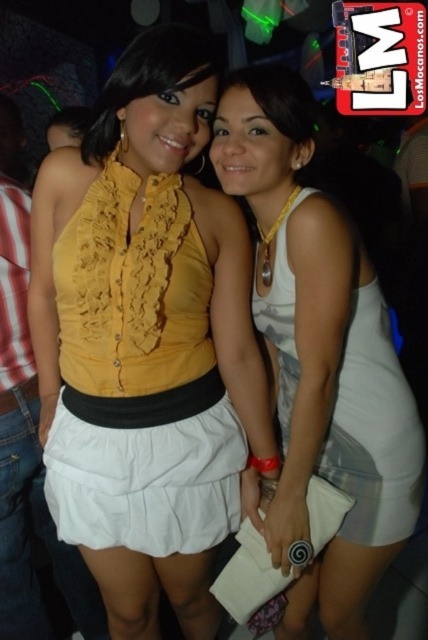
Question: Does white cotton skirt at center appear under matte yellow blouse at center?

Choices:
 (A) yes
 (B) no

Answer: (A)

Question: Does yellow ruffled blouse at center have a lesser width compared to matte yellow blouse at center?

Choices:
 (A) yes
 (B) no

Answer: (B)

Question: Which point appears closest to the camera in this image?

Choices:
 (A) (171, 65)
 (B) (276, 259)

Answer: (A)

Question: Estimate the real-world distances between objects in this image. Which object is farther from the yellow ruffled blouse at center?

Choices:
 (A) white cotton skirt at center
 (B) matte yellow blouse at center

Answer: (B)

Question: Does yellow ruffled blouse at center appear on the right side of white cotton skirt at center?

Choices:
 (A) yes
 (B) no

Answer: (A)

Question: Among these objects, which one is nearest to the camera?

Choices:
 (A) yellow ruffled blouse at center
 (B) white cotton skirt at center
 (C) matte yellow blouse at center

Answer: (C)